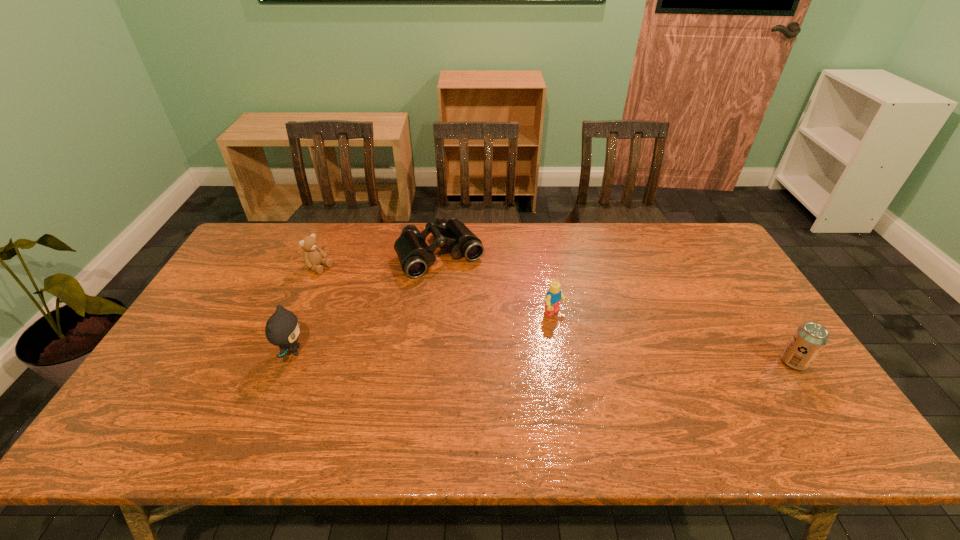
Locate an element on the screen. This screenshot has height=540, width=960. vacant space on the desktop that is between the kitten and the beer can and is positioned on the front-facing side of the binoculars is located at coordinates (508, 356).

The image size is (960, 540). Find the location of `vacant space on the desktop that is between the kitten and the beer can and is positioned on the front-facing side of the Lego`. vacant space on the desktop that is between the kitten and the beer can and is positioned on the front-facing side of the Lego is located at coordinates (615, 358).

The image size is (960, 540). What are the coordinates of `vacant spot on the desktop that is between the kitten and the beer can and is positioned on the face of the teddy bear` in the screenshot? It's located at (486, 355).